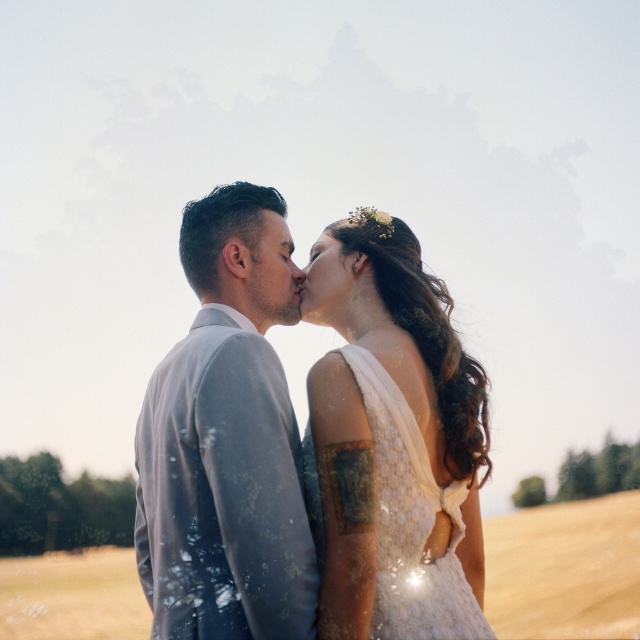
Question: Is light gray suit at center further to the viewer compared to golden wheat field at lower right?

Choices:
 (A) yes
 (B) no

Answer: (B)

Question: Among these points, which one is farthest from the camera?

Choices:
 (A) (362, 220)
 (B) (104, 628)
 (C) (477, 604)
 (D) (266, 204)

Answer: (B)

Question: Does light gray suit at center have a greater width compared to lace fabric dress at center?

Choices:
 (A) no
 (B) yes

Answer: (B)

Question: Observing the image, what is the correct spatial positioning of lace fabric dress at center in reference to matte floral hair accessory at center?

Choices:
 (A) below
 (B) above

Answer: (A)

Question: Among these points, which one is farthest from the camera?

Choices:
 (A) (406, 634)
 (B) (342, 220)
 (C) (493, 630)

Answer: (C)

Question: Among these points, which one is nearest to the camera?

Choices:
 (A) (333, 225)
 (B) (102, 612)
 (C) (182, 474)

Answer: (C)